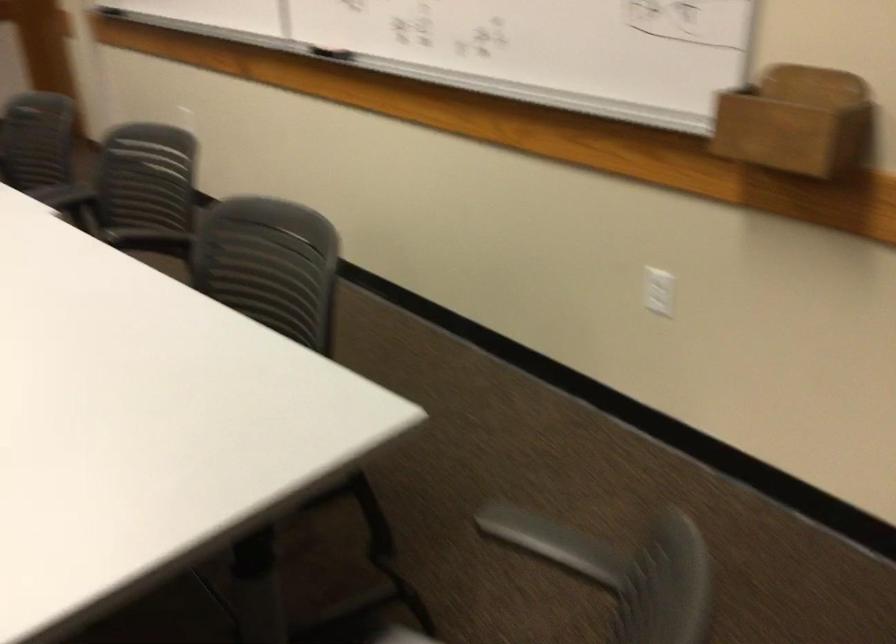
What do you see at coordinates (552, 538) in the screenshot? The height and width of the screenshot is (644, 896). I see `the grey chair armrest` at bounding box center [552, 538].